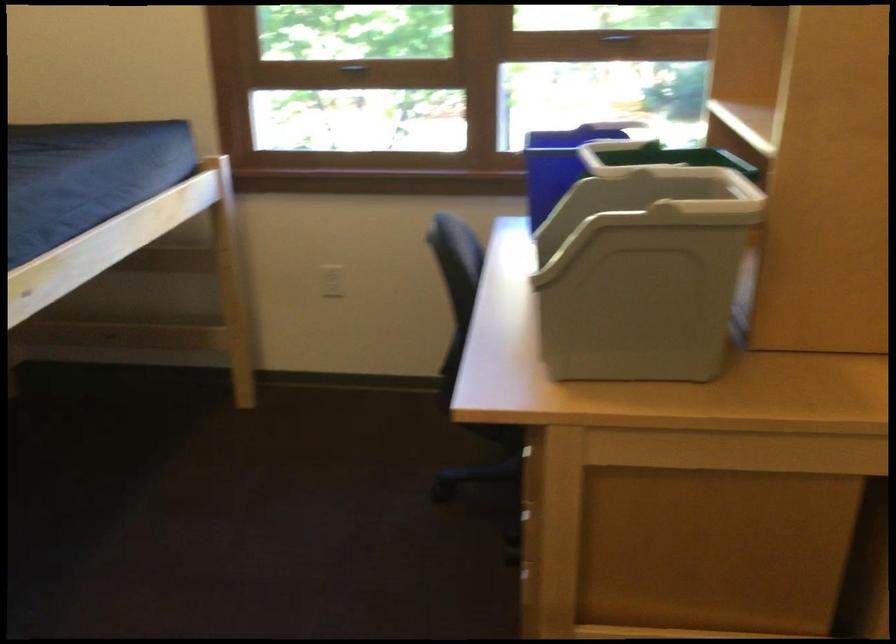
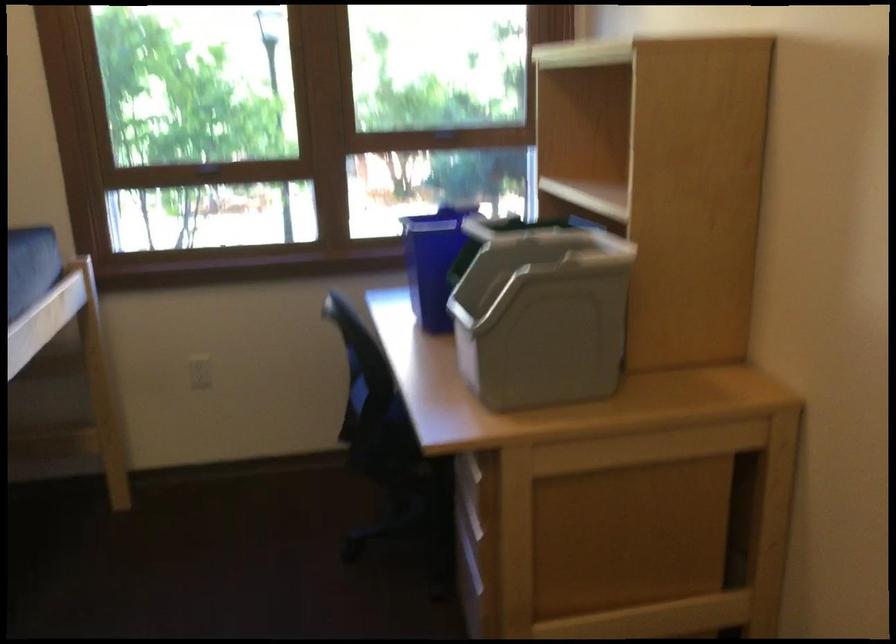
Locate, in the second image, the point that corresponds to point 625,269 in the first image.

(540, 313)